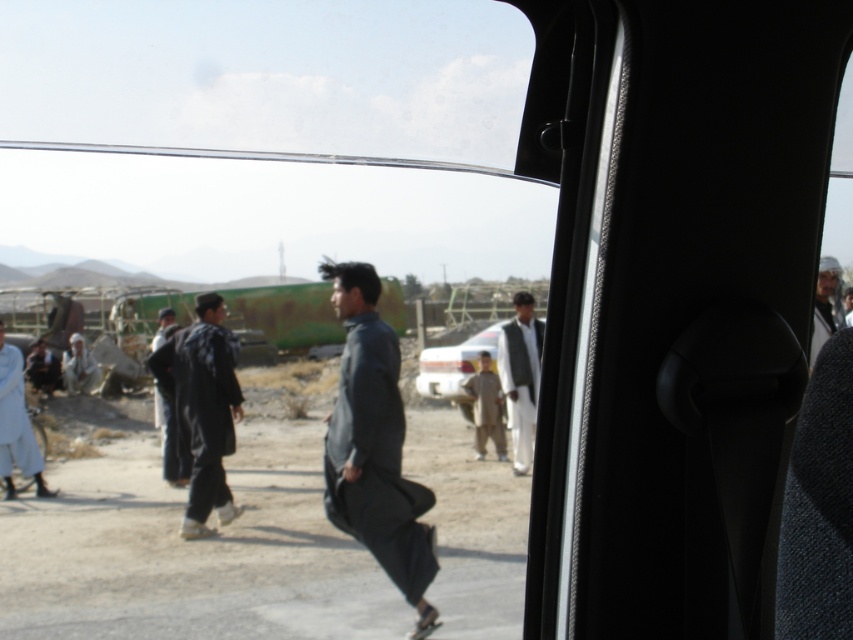
What do you see at coordinates (202, 408) in the screenshot?
I see `dark gray fabric coat at center` at bounding box center [202, 408].

Looking at this image, measure the distance between dark gray fabric coat at center and light brown fabric child at center.

dark gray fabric coat at center is 10.67 feet from light brown fabric child at center.

Is point (207, 490) more distant than point (498, 412)?

No, (207, 490) is in front of (498, 412).

You are a GUI agent. You are given a task and a screenshot of the screen. Output one action in this format:
    pyautogui.click(x=<x>, y=<y>)
    Task: Click on the dark gray fabric coat at center
    Image resolution: width=853 pixels, height=640 pixels.
    Given the screenshot: What is the action you would take?
    pyautogui.click(x=202, y=408)

This screenshot has width=853, height=640. Identify the location of light blue fabric at left. (16, 422).

Is light blue fabric at left to the left of dark gray fabric headscarf at upper right from the viewer's perspective?

Yes, light blue fabric at left is to the left of dark gray fabric headscarf at upper right.

Which is in front, point (45, 490) or point (834, 296)?

Point (834, 296)

The width and height of the screenshot is (853, 640). What are the coordinates of `light blue fabric at left` in the screenshot? It's located at (16, 422).

Who is shorter, dark gray fabric coat at center or light blue fabric at left?

light blue fabric at left is shorter.

Is point (230, 360) closer to viewer compared to point (19, 458)?

Yes, it is.

This screenshot has height=640, width=853. I want to click on dark gray fabric coat at center, so click(202, 408).